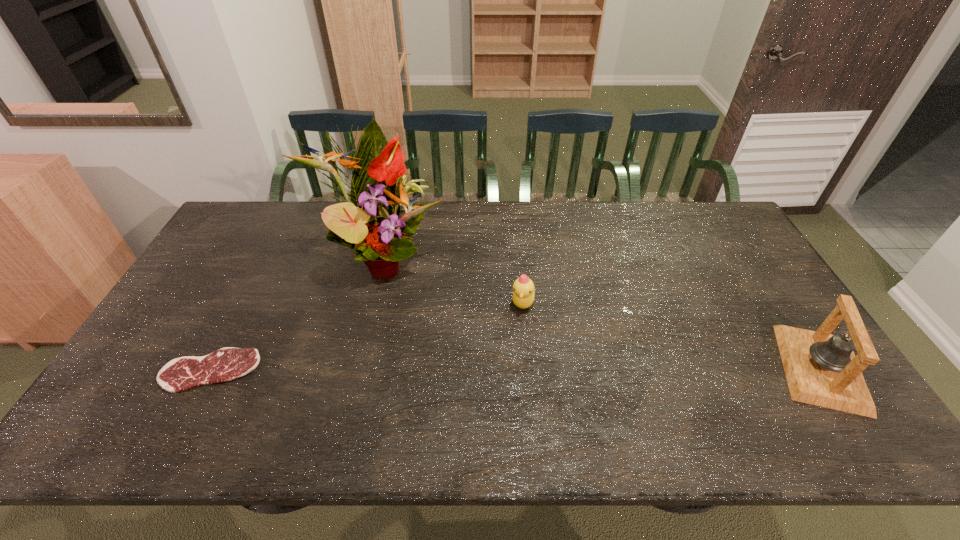
The width and height of the screenshot is (960, 540). I want to click on blank space located 0.350m on the front-facing side of the third object from right to left, so [526, 337].

Locate an element on the screen. Image resolution: width=960 pixels, height=540 pixels. vacant space located on the front-facing side of the third object from right to left is located at coordinates (472, 305).

The height and width of the screenshot is (540, 960). I want to click on vacant space located on the front-facing side of the third object from right to left, so click(x=523, y=335).

Where is `free location located 0.190m on the front-facing side of the second object from right to left`? The width and height of the screenshot is (960, 540). free location located 0.190m on the front-facing side of the second object from right to left is located at coordinates (540, 374).

You are a GUI agent. You are given a task and a screenshot of the screen. Output one action in this format:
    pyautogui.click(x=<x>, y=<y>)
    Task: Click on the free space located on the front-facing side of the second object from right to left
    
    Given the screenshot: What is the action you would take?
    pyautogui.click(x=530, y=336)

In order to click on vacant space located 0.160m on the front-facing side of the second object from right to left in this screenshot , I will do `click(537, 364)`.

Where is `object that is positioned at the far edge`? The height and width of the screenshot is (540, 960). object that is positioned at the far edge is located at coordinates (369, 223).

Identify the location of steak that is at the near edge. The width and height of the screenshot is (960, 540). (180, 374).

This screenshot has width=960, height=540. Find the location of `bell at the near edge`. bell at the near edge is located at coordinates (821, 369).

Locate an element on the screen. The width and height of the screenshot is (960, 540). object at the left edge is located at coordinates (180, 374).